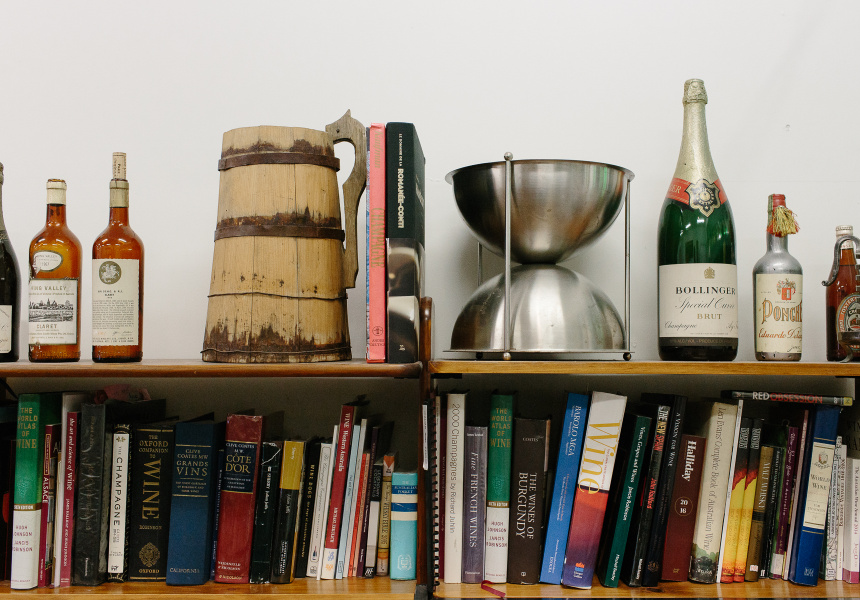
The image size is (860, 600). I want to click on wooden decanter, so click(278, 259).